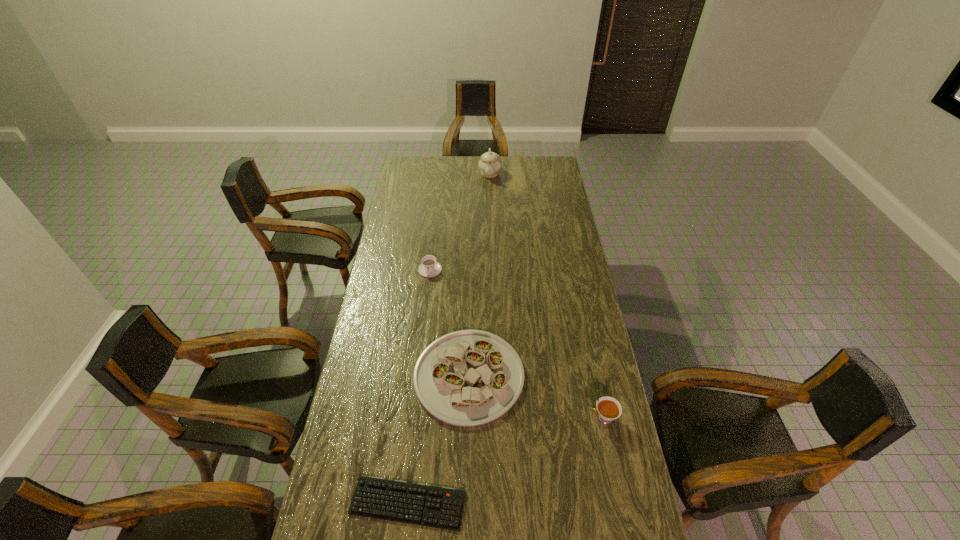
Where is `vacant region located on the side of the rightmost object with the handle`? vacant region located on the side of the rightmost object with the handle is located at coordinates (544, 418).

The image size is (960, 540). Identify the location of free spot located 0.110m on the side of the rightmost object with the handle. click(x=556, y=418).

At what (x,y) coordinates should I click in order to perform the action: click on vacant region located 0.360m on the side of the rightmost object with the handle. Please return your answer as a coordinate pair (x, y). Looking at the image, I should click on (481, 418).

Where is `free space located on the right of the platter`? Image resolution: width=960 pixels, height=540 pixels. free space located on the right of the platter is located at coordinates (591, 376).

Locate an element on the screen. free space located on the handle side of the left teacup is located at coordinates (428, 286).

Where is `free space located on the back of the shortest object`? The width and height of the screenshot is (960, 540). free space located on the back of the shortest object is located at coordinates (420, 386).

The height and width of the screenshot is (540, 960). Find the location of `object present at the far edge`. object present at the far edge is located at coordinates coord(489,164).

Where is `object located in the left edge section of the desktop`? The width and height of the screenshot is (960, 540). object located in the left edge section of the desktop is located at coordinates (441, 507).

Locate an element on the screen. This screenshot has height=540, width=960. object at the right edge is located at coordinates (608, 408).

In the image, there is a desktop. Identify the location of vacant space at the far edge. The width and height of the screenshot is (960, 540). (469, 160).